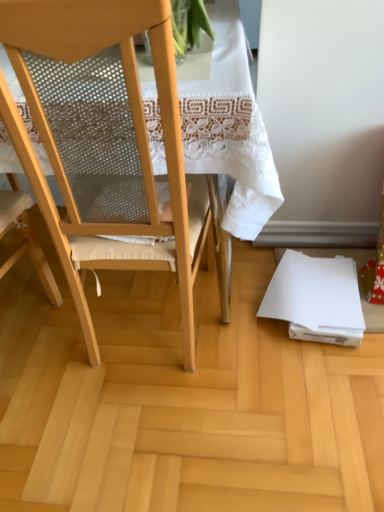
Question: Is point (139, 87) positioned closer to the camera than point (276, 313)?

Choices:
 (A) closer
 (B) farther

Answer: (A)

Question: In the image, is matte wood chair at center on the left side or the right side of white paper at lower right?

Choices:
 (A) left
 (B) right

Answer: (A)

Question: Considering the real-world distances, which object is closest to the wooden floor at lower right?

Choices:
 (A) matte wood chair at center
 (B) white paper at lower right

Answer: (B)

Question: Which of these objects is positioned farthest from the matte wood chair at center?

Choices:
 (A) white paper at lower right
 (B) wooden floor at lower right

Answer: (A)